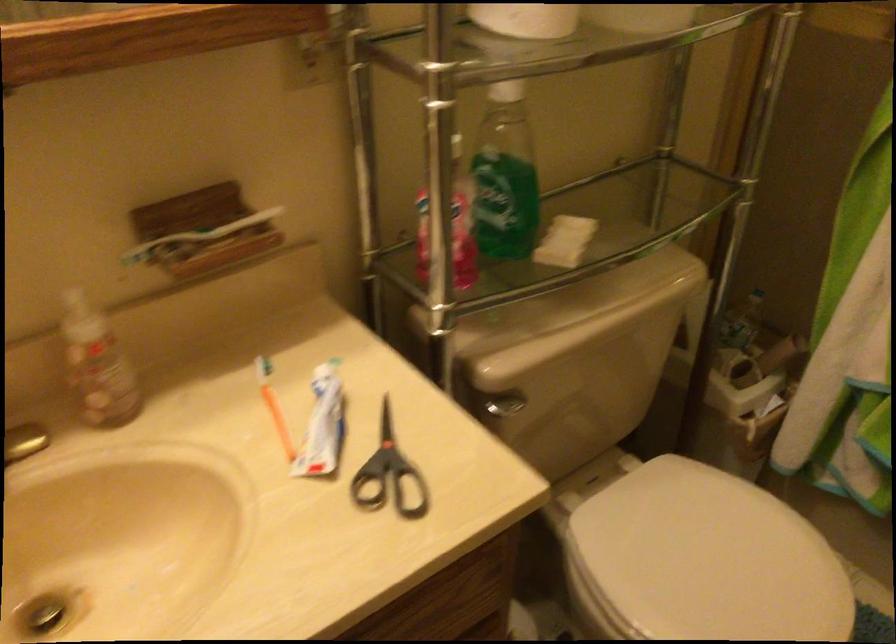
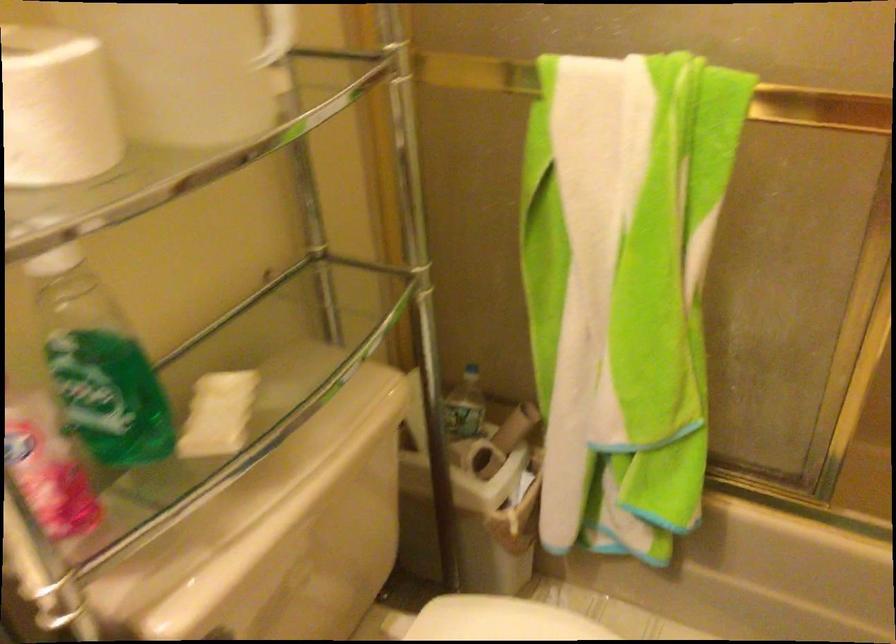
Locate, in the second image, the point that corresponds to the point at 713,478 in the first image.

(500, 620)